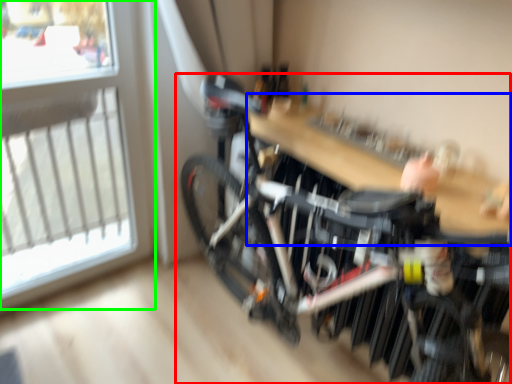
Question: Which is farther away from bicycle (highlighted by a red box)? table (highlighted by a blue box) or window (highlighted by a green box)?

Choices:
 (A) table
 (B) window

Answer: (B)